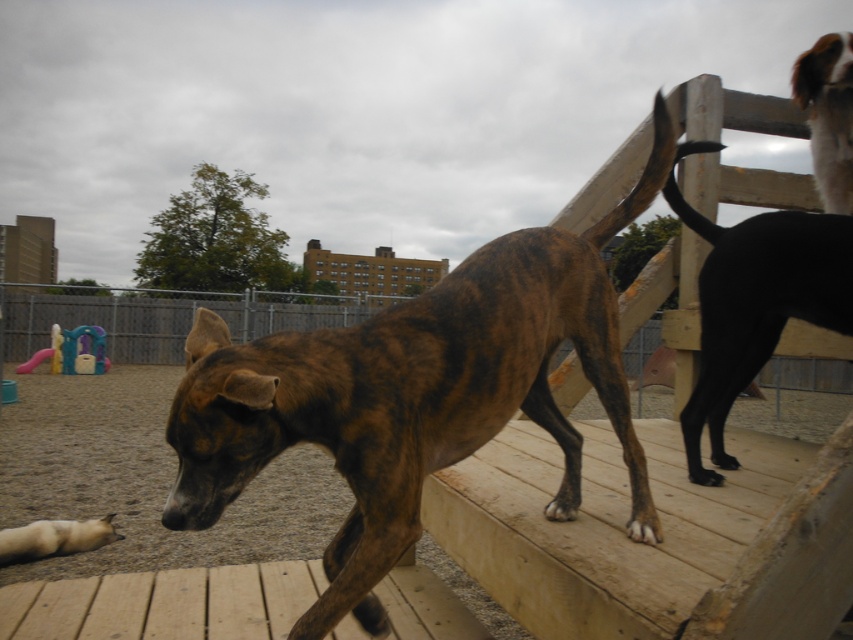
Question: Which point appears closest to the camera in this image?

Choices:
 (A) (785, 285)
 (B) (612, 358)

Answer: (B)

Question: Among these points, which one is farthest from the camera?

Choices:
 (A) (746, 227)
 (B) (30, 330)
 (C) (401, 467)
 (D) (30, 538)

Answer: (B)

Question: Considering the real-world distances, which object is farthest from the brown brindle dog at upper right?

Choices:
 (A) black glossy dog at upper right
 (B) white fur dog at lower left

Answer: (B)

Question: Can you confirm if black glossy dog at upper right is smaller than brown brindle dog at upper right?

Choices:
 (A) no
 (B) yes

Answer: (A)

Question: Does brown brindle dog at center appear on the right side of black glossy dog at upper right?

Choices:
 (A) yes
 (B) no

Answer: (B)

Question: Where is brown brindle dog at center located in relation to brown wooden rail at center in the image?

Choices:
 (A) left
 (B) right

Answer: (B)